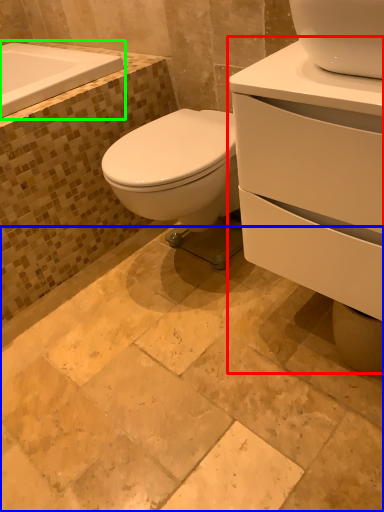
Question: Estimate the real-world distances between objects in this image. Which object is closer to porcelain (highlighted by a red box), ceramic tile (highlighted by a blue box) or bath (highlighted by a green box)?

Choices:
 (A) ceramic tile
 (B) bath

Answer: (A)